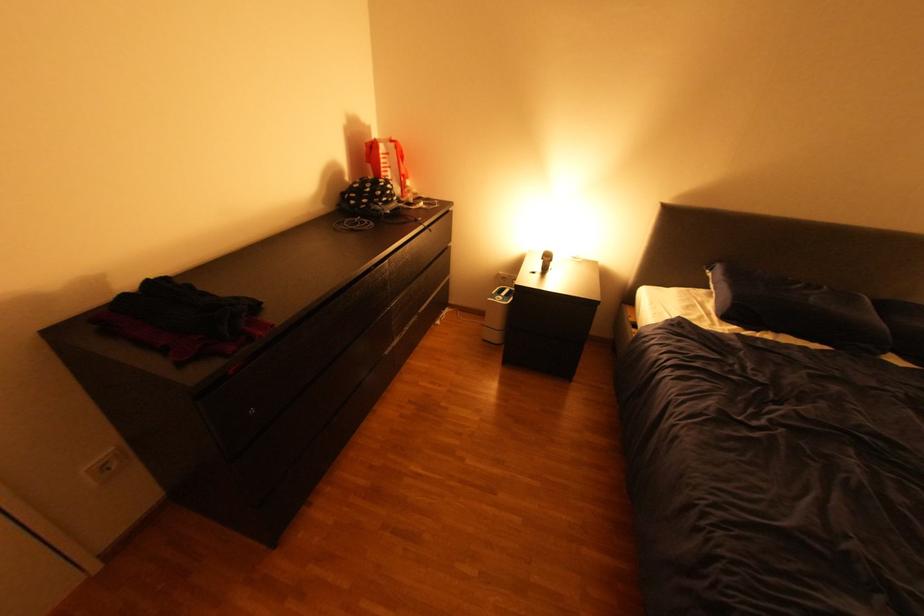
Find where to lift the paper bag handle. Please return your answer as a coordinate pair (x, y).

(382, 132)